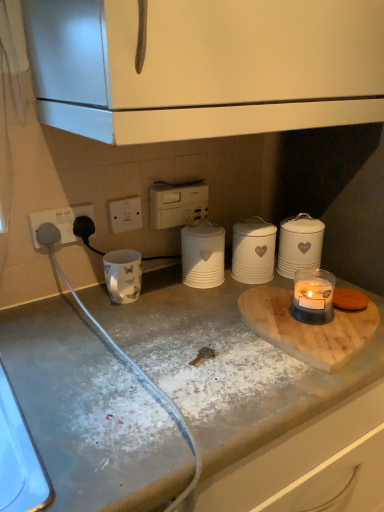
The width and height of the screenshot is (384, 512). What are the coordinates of `vacant space that is in between white ceramic canister at center, which ranks as the 2th appliance in top-to-bottom order, and wooden cutting board at center` in the screenshot? It's located at (216, 307).